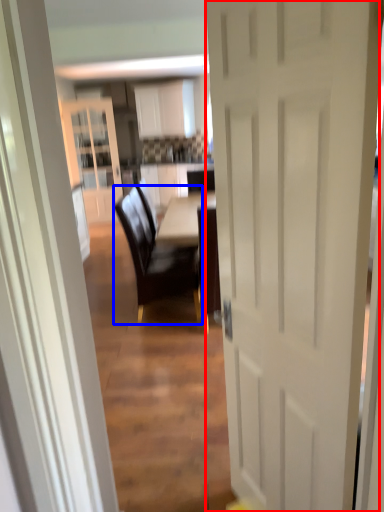
Question: Which object appears farthest to the camera in this image, door (highlighted by a red box) or chair (highlighted by a blue box)?

Choices:
 (A) door
 (B) chair

Answer: (B)